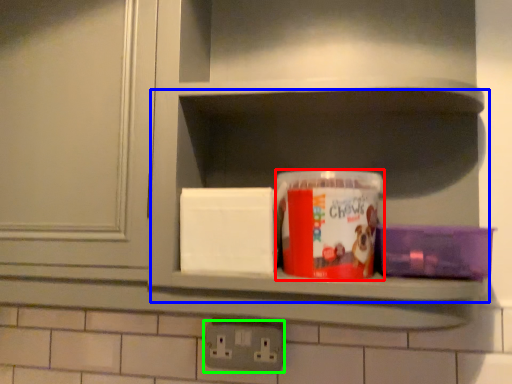
Question: Based on their relative distances, which object is farther from box (highlighted by a red box)? Choose from cabinet (highlighted by a blue box) and electric outlet (highlighted by a green box).

Choices:
 (A) cabinet
 (B) electric outlet

Answer: (B)